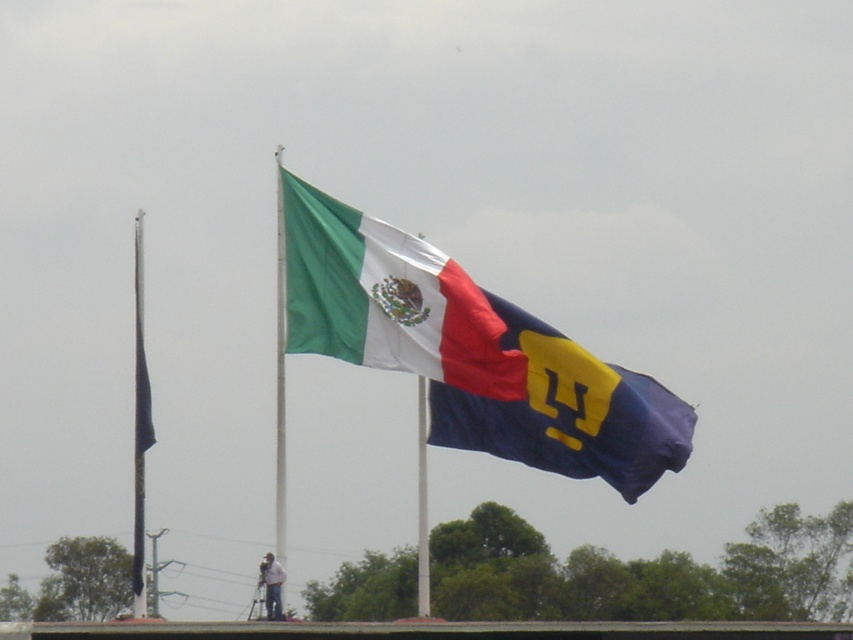
You are a photographer trying to capture both the blue fabric flag at center and the black matte flag pole at left in a single frame. Based on their positions, which flag should you focus on first to ensure both are in the shot?

The blue fabric flag at center is positioned on the right side of the black matte flag pole at left. Therefore, you should focus on the black matte flag pole at left first, as it is closer to your position, ensuring both flags remain in the frame.

You are a photographer positioned at the camera location. You want to capture a closeup shot of the textured cotton flag at center. Given that your camera has a maximum zoom range of 100 feet, can you achieve this without moving closer?

The textured cotton flag at center is 291.67 feet away from camera. Since the maximum zoom range is 100 feet, you cannot achieve a closeup without moving closer.